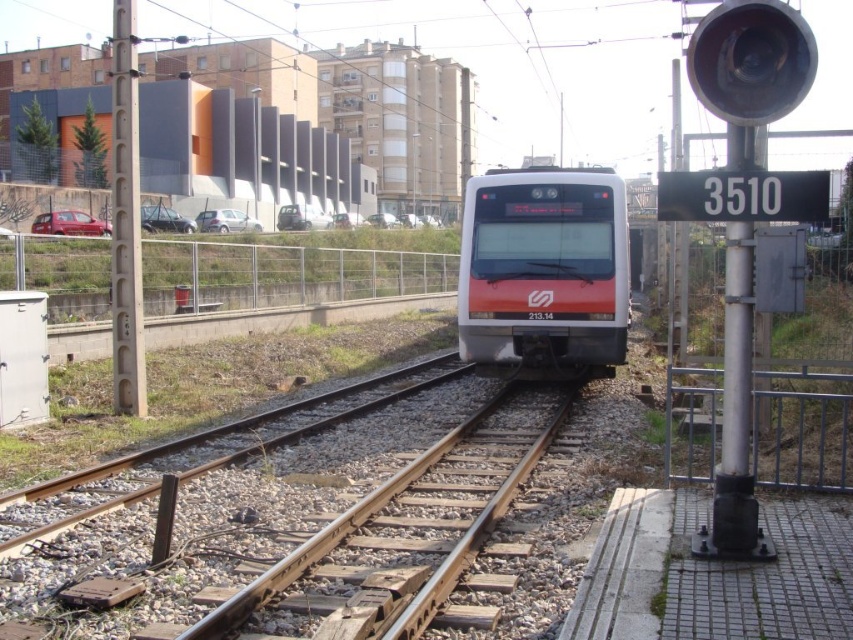
Question: Which object is the closest to the smooth gray pole at left?

Choices:
 (A) rusty metal train track at center
 (B) white glossy passenger train at center

Answer: (B)

Question: Which object is farther from the camera taking this photo?

Choices:
 (A) white glossy passenger train at center
 (B) rusty metal train track at center
 (C) smooth gray pole at left

Answer: (A)

Question: Is white glossy passenger train at center bigger than smooth gray pole at left?

Choices:
 (A) no
 (B) yes

Answer: (A)

Question: Can you confirm if rusty metal train track at center is positioned above smooth gray pole at left?

Choices:
 (A) no
 (B) yes

Answer: (A)

Question: Does rusty metal train track at center appear on the left side of white glossy passenger train at center?

Choices:
 (A) no
 (B) yes

Answer: (B)

Question: Which point is closer to the camera?

Choices:
 (A) white glossy passenger train at center
 (B) rusty metal train track at center

Answer: (B)